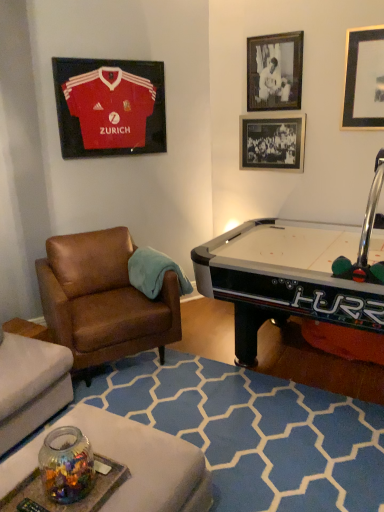
Question: From a real-world perspective, is brown leather chair at left on top of black glass picture frame at upper right, the 2th picture frame from the right?

Choices:
 (A) yes
 (B) no

Answer: (B)

Question: Does brown leather chair at left appear on the left side of black glass picture frame at upper right, the 2th picture frame from the right?

Choices:
 (A) no
 (B) yes

Answer: (B)

Question: Is brown leather chair at left oriented away from black glass picture frame at upper right, the 2th picture frame from the right?

Choices:
 (A) yes
 (B) no

Answer: (B)

Question: From the image's perspective, is brown leather chair at left beneath black glass picture frame at upper right, the 2th picture frame from the right?

Choices:
 (A) yes
 (B) no

Answer: (A)

Question: From the image's perspective, would you say brown leather chair at left is positioned over black glass picture frame at upper right, the 2th picture frame from the right?

Choices:
 (A) yes
 (B) no

Answer: (B)

Question: Considering the relative sizes of brown leather chair at left and black glass picture frame at upper right, placed as the 3th picture frame when sorted from left to right, in the image provided, is brown leather chair at left shorter than black glass picture frame at upper right, placed as the 3th picture frame when sorted from left to right,?

Choices:
 (A) yes
 (B) no

Answer: (B)

Question: From a real-world perspective, is black glass picture frame at upper right, placed as the 3th picture frame when sorted from left to right, positioned under brown leather chair at left based on gravity?

Choices:
 (A) yes
 (B) no

Answer: (B)

Question: Considering the relative sizes of black glass picture frame at upper right, placed as the 3th picture frame when sorted from left to right, and brown leather chair at left in the image provided, is black glass picture frame at upper right, placed as the 3th picture frame when sorted from left to right, wider than brown leather chair at left?

Choices:
 (A) yes
 (B) no

Answer: (B)

Question: Does black glass picture frame at upper right, placed as the 3th picture frame when sorted from left to right, have a lesser width compared to brown leather chair at left?

Choices:
 (A) yes
 (B) no

Answer: (A)

Question: From the image's perspective, is black glass picture frame at upper right, the 2th picture frame from the right, located beneath brown leather chair at left?

Choices:
 (A) yes
 (B) no

Answer: (B)

Question: Considering the relative positions of black glass picture frame at upper right, the 2th picture frame from the right, and brown leather chair at left in the image provided, is black glass picture frame at upper right, the 2th picture frame from the right, to the left of brown leather chair at left from the viewer's perspective?

Choices:
 (A) yes
 (B) no

Answer: (B)

Question: Does black glass picture frame at upper right, placed as the 3th picture frame when sorted from left to right, touch brown leather chair at left?

Choices:
 (A) no
 (B) yes

Answer: (A)

Question: Considering the relative sizes of black matte picture frame at upper right, arranged as the 3th picture frame when viewed from the right, and brown leather chair at left in the image provided, is black matte picture frame at upper right, arranged as the 3th picture frame when viewed from the right, bigger than brown leather chair at left?

Choices:
 (A) no
 (B) yes

Answer: (A)